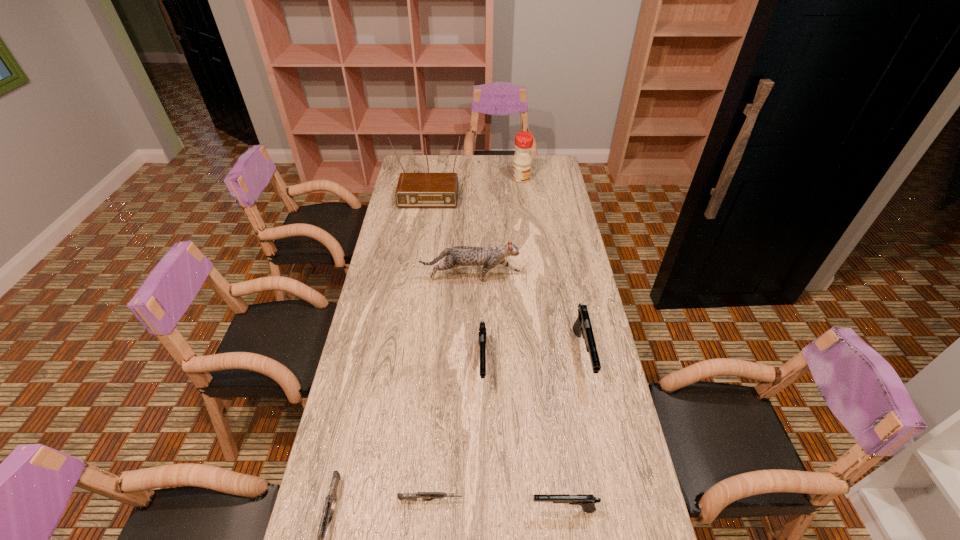
Find the location of a particular element. The image size is (960, 540). radio_receiver is located at coordinates (414, 190).

Find the location of a particular element. The image size is (960, 540). red condiment is located at coordinates (522, 159).

The height and width of the screenshot is (540, 960). I want to click on the sixth shortest object, so click(489, 257).

Locate an element on the screen. cat is located at coordinates (489, 257).

What are the coordinates of `the rightmost black gun` in the screenshot? It's located at (582, 326).

Where is `the rightmost object`? This screenshot has width=960, height=540. the rightmost object is located at coordinates (582, 326).

You are a GUI agent. You are given a task and a screenshot of the screen. Output one action in this format:
    pyautogui.click(x=<x>, y=<y>)
    Task: Click on the fourth shortest gun
    The image size is (960, 540).
    Given the screenshot: What is the action you would take?
    pyautogui.click(x=482, y=334)

This screenshot has width=960, height=540. Find the location of `the second biggest black gun`. the second biggest black gun is located at coordinates (482, 334).

Where is `the third shortest object`? the third shortest object is located at coordinates (587, 501).

The height and width of the screenshot is (540, 960). I want to click on the nearest black gun, so click(587, 501).